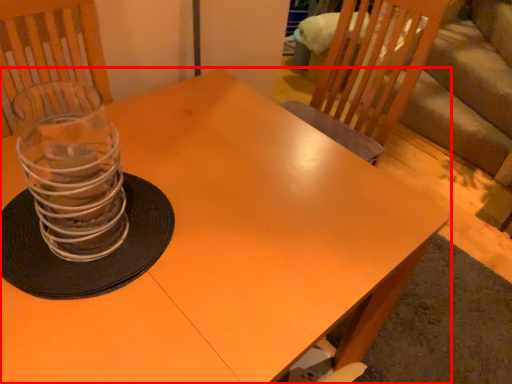
Question: From the image's perspective, considering the relative positions of table (annotated by the red box) and candle holder in the image provided, where is table (annotated by the red box) located with respect to the staircase?

Choices:
 (A) below
 (B) above

Answer: (A)